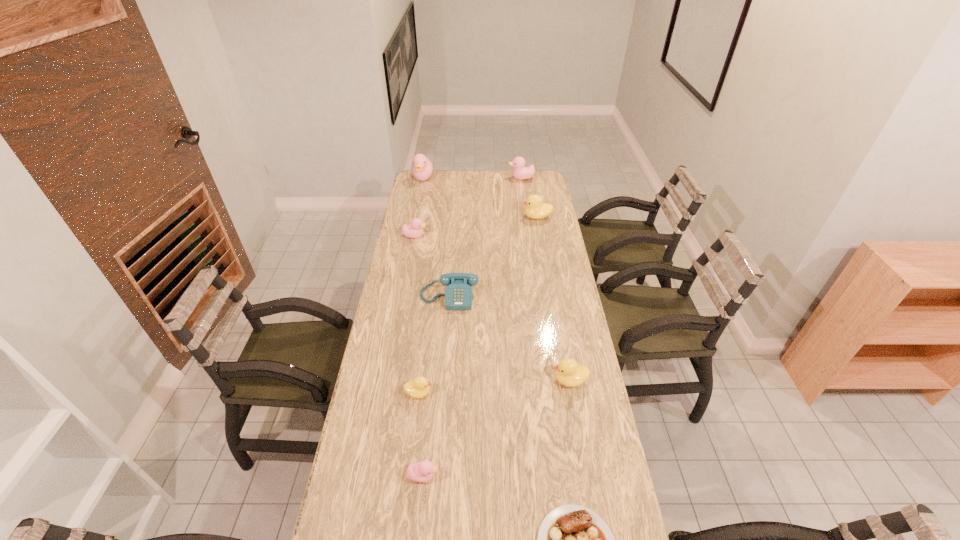
This screenshot has width=960, height=540. I want to click on vacant point located between the blue telephone and the leftmost yellow duckling, so click(434, 345).

Find the location of `blank region between the seventh nearest object and the smallest pink duckling`. blank region between the seventh nearest object and the smallest pink duckling is located at coordinates (480, 347).

Identify the location of object that stands as the fourth closest to the second smallest yellow duckling. Image resolution: width=960 pixels, height=540 pixels. (421, 472).

Locate which object ranks fourth in proximity to the second smallest yellow duckling. Please provide its 2D coordinates. Your answer should be formatted as a tuple, i.e. [(x, y)], where the tuple contains the x and y coordinates of a point satisfying the conditions above.

[(421, 472)]

Locate an element on the screen. The height and width of the screenshot is (540, 960). duckling that is the sixth nearest to the second smallest yellow duckling is located at coordinates (422, 169).

Select which duckling appears as the second closest to the rightmost pink duckling. Please provide its 2D coordinates. Your answer should be formatted as a tuple, i.e. [(x, y)], where the tuple contains the x and y coordinates of a point satisfying the conditions above.

[(422, 169)]

Identify which pink duckling is the second nearest to the tallest object. Please provide its 2D coordinates. Your answer should be formatted as a tuple, i.e. [(x, y)], where the tuple contains the x and y coordinates of a point satisfying the conditions above.

[(415, 231)]

You are a GUI agent. You are given a task and a screenshot of the screen. Output one action in this format:
    pyautogui.click(x=<x>, y=<y>)
    Task: Click on the pink duckling that is the second nearest to the second smallest yellow duckling
    The height and width of the screenshot is (540, 960).
    Given the screenshot: What is the action you would take?
    pyautogui.click(x=415, y=231)

The width and height of the screenshot is (960, 540). I want to click on yellow duckling that is the third nearest to the steak, so click(x=535, y=209).

Select which yellow duckling is the third closest to the nearest duckling. Please provide its 2D coordinates. Your answer should be formatted as a tuple, i.e. [(x, y)], where the tuple contains the x and y coordinates of a point satisfying the conditions above.

[(535, 209)]